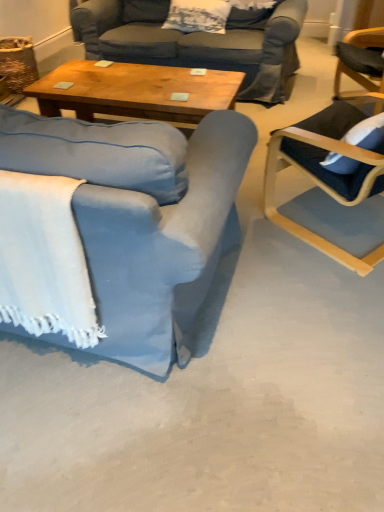
Question: Based on their sizes in the image, would you say blue fabric chair at left, which is the 2th chair from right to left, is bigger or smaller than white textured pillow at upper center?

Choices:
 (A) big
 (B) small

Answer: (A)

Question: Considering the relative positions of blue fabric chair at left, which is the 2th chair from right to left, and white textured pillow at upper center in the image provided, is blue fabric chair at left, which is the 2th chair from right to left, to the left or to the right of white textured pillow at upper center?

Choices:
 (A) right
 (B) left

Answer: (B)

Question: Which of these objects is positioned farthest from the dark blue fabric chair at right, which ranks as the 1th chair in right-to-left order?

Choices:
 (A) white textured pillow at upper center
 (B) blue fabric chair at left, which is the 2th chair from right to left
 (C) wooden coffee table at center
 (D) white woven blanket at lower left

Answer: (A)

Question: Which object is the farthest from the blue fabric chair at left, marked as the 1th chair in a left-to-right arrangement?

Choices:
 (A) white textured pillow at upper center
 (B) dark blue fabric chair at right, which ranks as the 1th chair in right-to-left order
 (C) wooden coffee table at center
 (D) white woven blanket at lower left

Answer: (A)